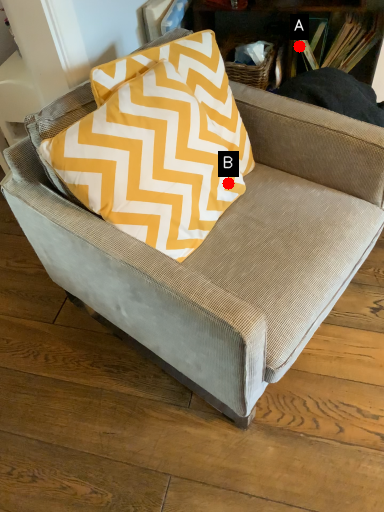
Question: Two points are circled on the image, labeled by A and B beside each circle. Among these points, which one is farthest from the camera?

Choices:
 (A) A is further
 (B) B is further

Answer: (A)